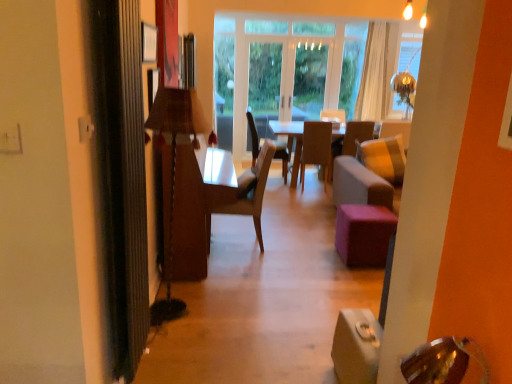
You are a GUI agent. You are given a task and a screenshot of the screen. Output one action in this format:
    pyautogui.click(x=<x>, y=<y>)
    Task: Click on the vacant area located to the right-hand side of wooden lamp at left
    
    Given the screenshot: What is the action you would take?
    pyautogui.click(x=240, y=301)